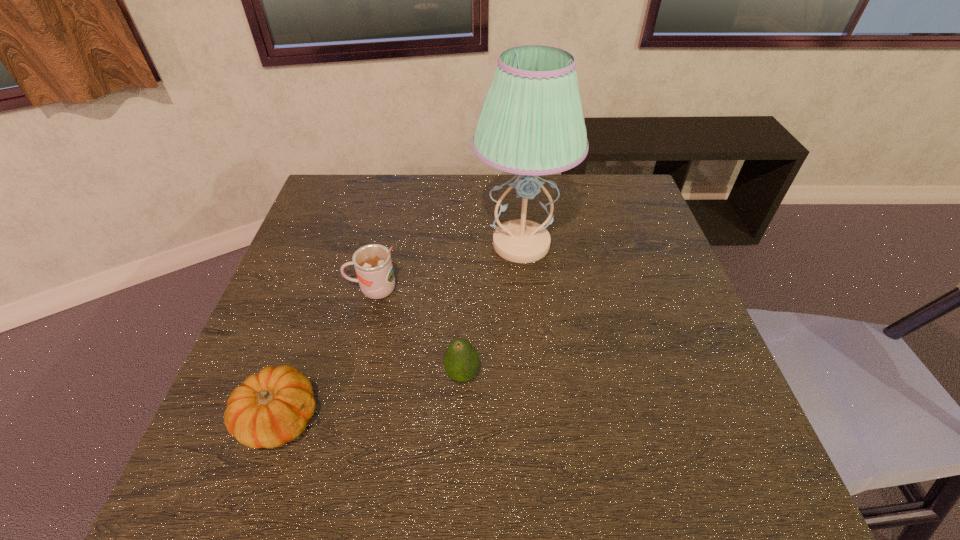
Locate which object ranks third in proximity to the tallest object. Please provide its 2D coordinates. Your answer should be formatted as a tuple, i.e. [(x, y)], where the tuple contains the x and y coordinates of a point satisfying the conditions above.

[(271, 408)]

At what (x,y) coordinates should I click in order to perform the action: click on the third closest object to the cup. Please return your answer as a coordinate pair (x, y). Image resolution: width=960 pixels, height=540 pixels. Looking at the image, I should click on (271, 408).

Identify the location of vacant space that satisfies the following two spatial constraints: 1. on the side with the handle of the cup; 2. on the back side of the avocado. (353, 375).

You are a GUI agent. You are given a task and a screenshot of the screen. Output one action in this format:
    pyautogui.click(x=<x>, y=<y>)
    Task: Click on the free space that satisfies the following two spatial constraints: 1. on the back side of the gourd; 2. on the left side of the tallest object
    Image resolution: width=960 pixels, height=540 pixels.
    Given the screenshot: What is the action you would take?
    pyautogui.click(x=340, y=244)

At what (x,y) coordinates should I click in order to perform the action: click on vacant space that satisfies the following two spatial constraints: 1. on the side with the handle of the second tallest object; 2. on the left side of the avocado. Please return your answer as a coordinate pair (x, y). Looking at the image, I should click on (353, 375).

Identify the location of vacant area that satisfies the following two spatial constraints: 1. on the side with the handle of the avocado; 2. on the left side of the third shortest object. Image resolution: width=960 pixels, height=540 pixels. (353, 375).

Locate an element on the screen. The width and height of the screenshot is (960, 540). free space that satisfies the following two spatial constraints: 1. on the back side of the avocado; 2. on the side with the handle of the second tallest object is located at coordinates (465, 289).

What are the coordinates of `vacant space that satisfies the following two spatial constraints: 1. on the side with the handle of the second tallest object; 2. on the right side of the avocado` in the screenshot? It's located at (353, 375).

Find the location of a particular element. vacant space that satisfies the following two spatial constraints: 1. on the side with the handle of the cup; 2. on the front side of the gourd is located at coordinates (343, 418).

Identify the location of vacant space that satisfies the following two spatial constraints: 1. on the side with the handle of the cup; 2. on the front side of the gourd. This screenshot has height=540, width=960. (343, 418).